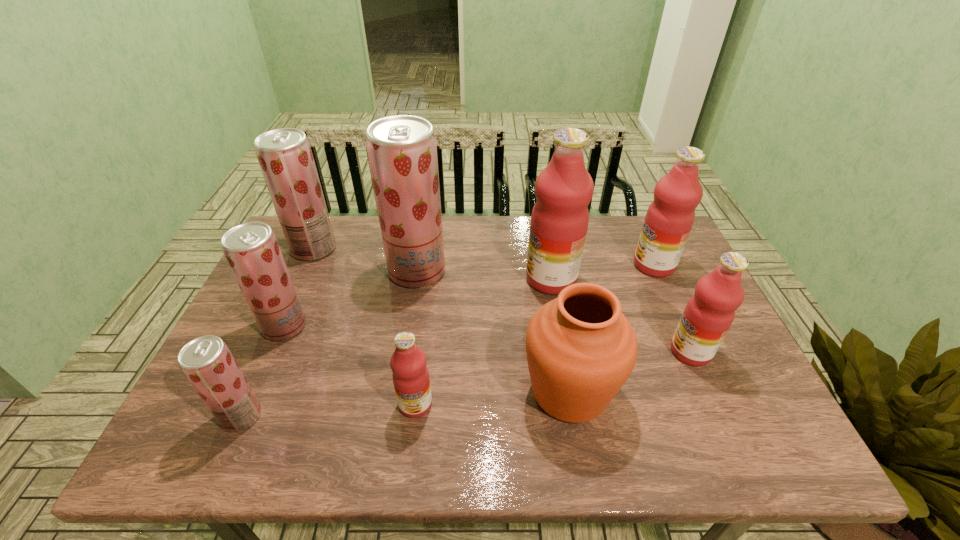
This screenshot has width=960, height=540. I want to click on the smallest pink fruit juice, so click(x=410, y=375).

This screenshot has width=960, height=540. What are the coordinates of `free space located 0.060m on the left of the biggest strawberry fruit juice` in the screenshot? It's located at (369, 271).

The height and width of the screenshot is (540, 960). In order to click on free region located 0.150m on the label of the sixth fruit juice from left to right in this screenshot , I will do `click(475, 279)`.

Find the location of a particular element. vacant space located 0.340m on the label of the sixth fruit juice from left to right is located at coordinates (411, 279).

What are the coordinates of `vacant region located on the label of the sixth fruit juice from left to right` in the screenshot? It's located at (505, 279).

Locate an element on the screen. vacant space located on the right of the third smallest strawberry fruit juice is located at coordinates (361, 248).

Identify the location of vacant space located 0.110m on the label of the third smallest pink fruit juice. The height and width of the screenshot is (540, 960). (597, 265).

I want to click on vacant space located on the label of the third smallest pink fruit juice, so click(597, 265).

The image size is (960, 540). I want to click on vacant space situated 0.130m on the label of the third smallest pink fruit juice, so click(x=591, y=265).

Locate an element on the screen. The image size is (960, 540). free location located on the right of the second smallest strawberry fruit juice is located at coordinates (400, 326).